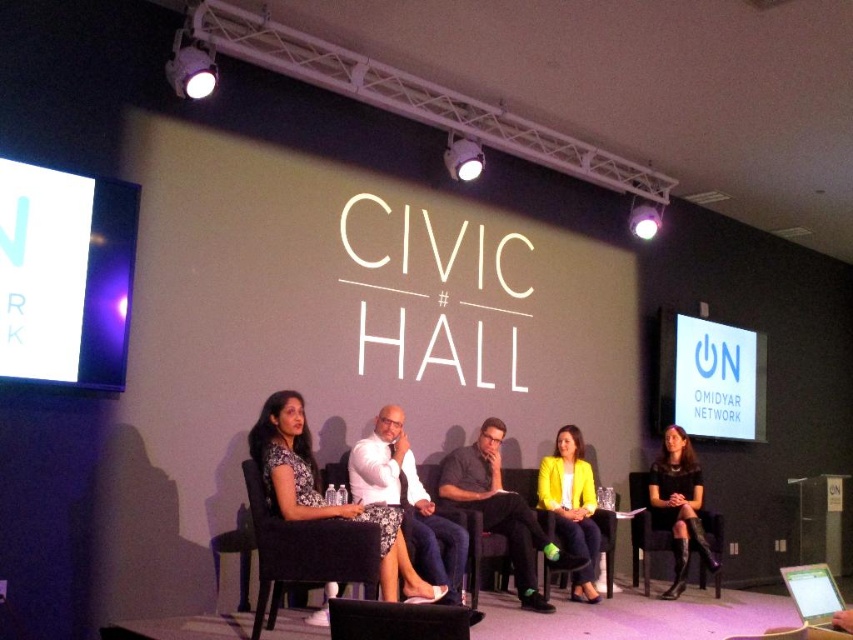
Is point (584, 477) less distant than point (703, 512)?

Yes.

Which is below, yellow matte blazer at center or black leather chair at lower right?

black leather chair at lower right is below.

Between point (579, 577) and point (640, 480), which one is positioned behind?

Positioned behind is point (640, 480).

Image resolution: width=853 pixels, height=640 pixels. I want to click on yellow matte blazer at center, so click(x=572, y=508).

Which is more to the left, yellow matte blazer at center or black fabric chair at center?

From the viewer's perspective, black fabric chair at center appears more on the left side.

This screenshot has width=853, height=640. In order to click on yellow matte blazer at center in this screenshot , I will do `click(572, 508)`.

Identify the location of yellow matte blazer at center. (572, 508).

Between matte black dress at center and black leather chair at lower right, which one has more height?

matte black dress at center

Does matte black dress at center appear on the left side of black leather chair at lower right?

Yes, matte black dress at center is to the left of black leather chair at lower right.

Between point (317, 474) and point (647, 508), which one is positioned in front?

Point (317, 474)

This screenshot has width=853, height=640. Find the location of `matte black dress at center`. matte black dress at center is located at coordinates (323, 496).